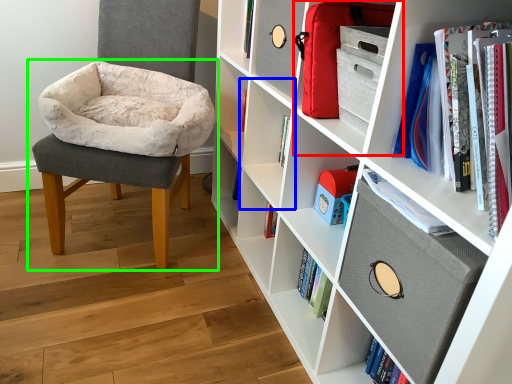
Question: Based on their relative distances, which object is nearer to cabinet (highlighted by a red box)? Choose from shelf (highlighted by a blue box) and chair (highlighted by a green box).

Choices:
 (A) shelf
 (B) chair

Answer: (A)